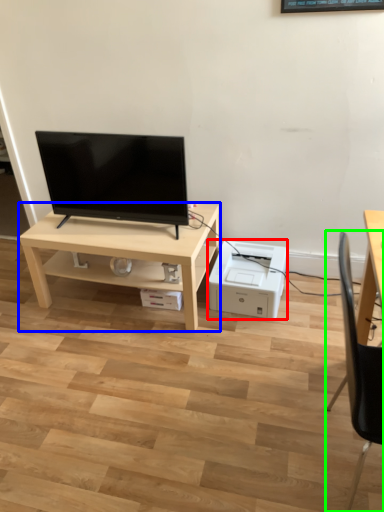
Question: Considering the real-world distances, which object is farthest from printer (highlighted by a red box)? table (highlighted by a blue box) or chair (highlighted by a green box)?

Choices:
 (A) table
 (B) chair

Answer: (B)